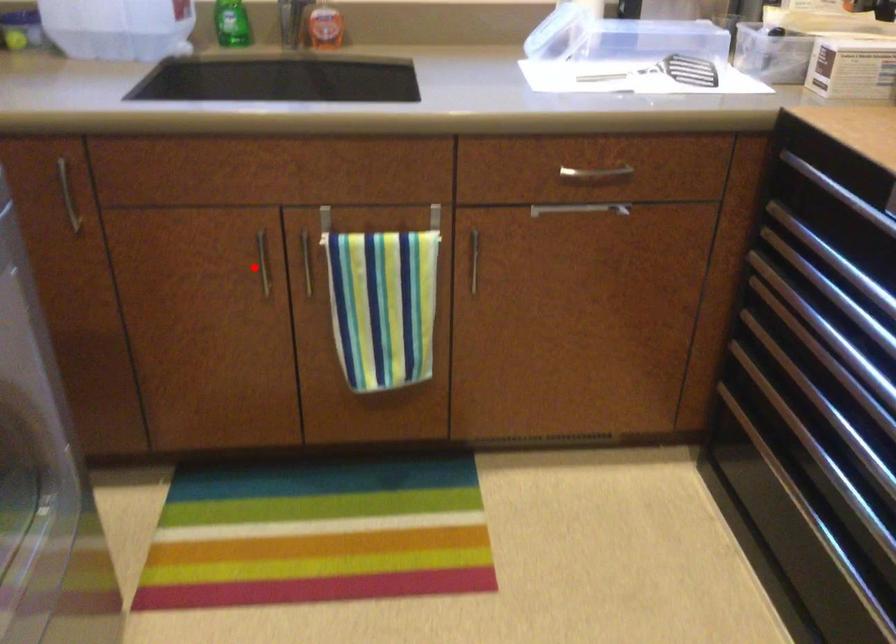
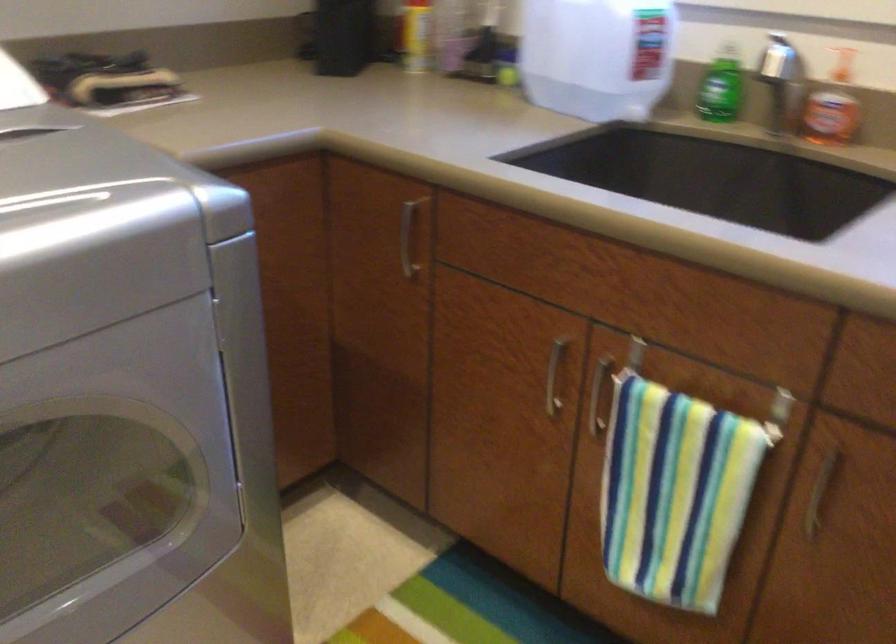
Question: I am providing you with two images of the same scene from different viewpoints. Given a red point in image1, look at the same physical point in image2. Is it:

Choices:
 (A) Closer to the viewpoint
 (B) Farther from the viewpoint

Answer: (A)